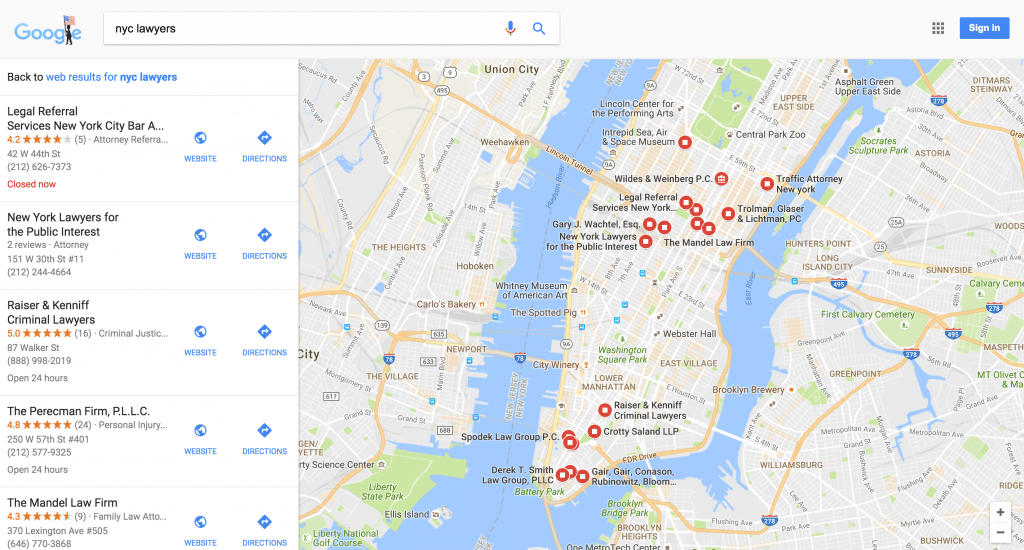
Find the location of a particular element. The height and width of the screenshot is (550, 1024). map of new york is located at coordinates (640, 292).